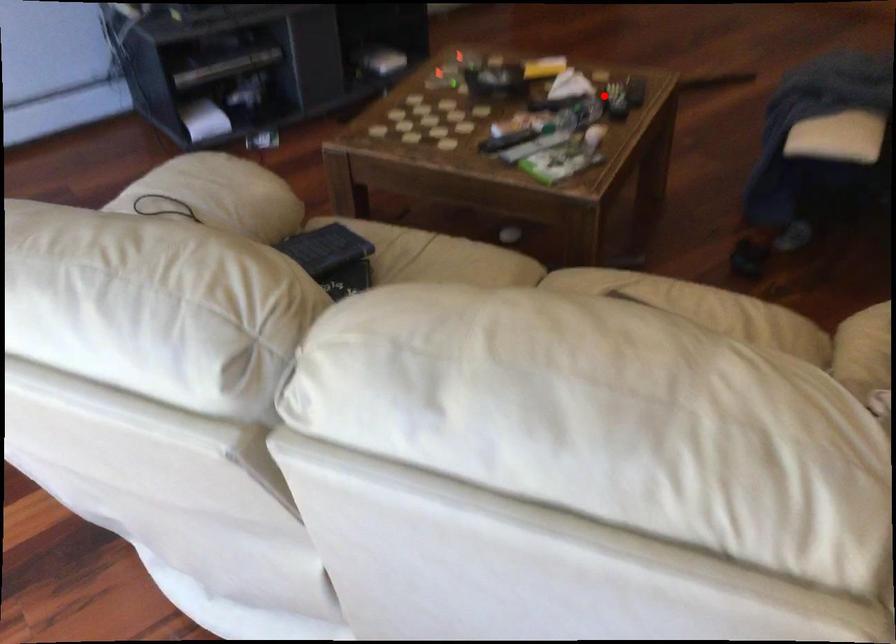
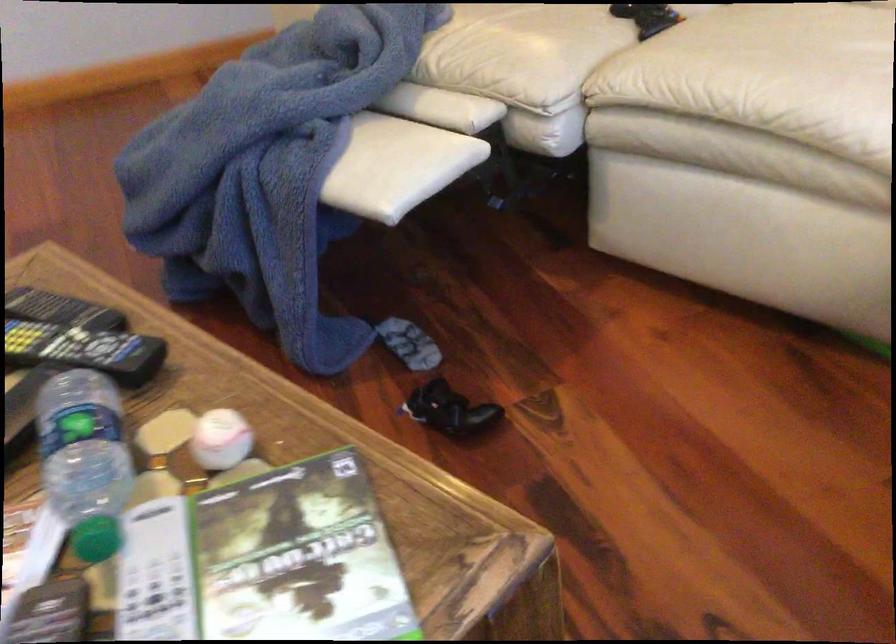
Question: I am providing you with two images of the same scene from different viewpoints. Image1 has a red point marked. In image2, the corresponding 3D location appears at what relative position? Reply with the corresponding letter.

Choices:
 (A) Closer
 (B) Farther

Answer: (A)